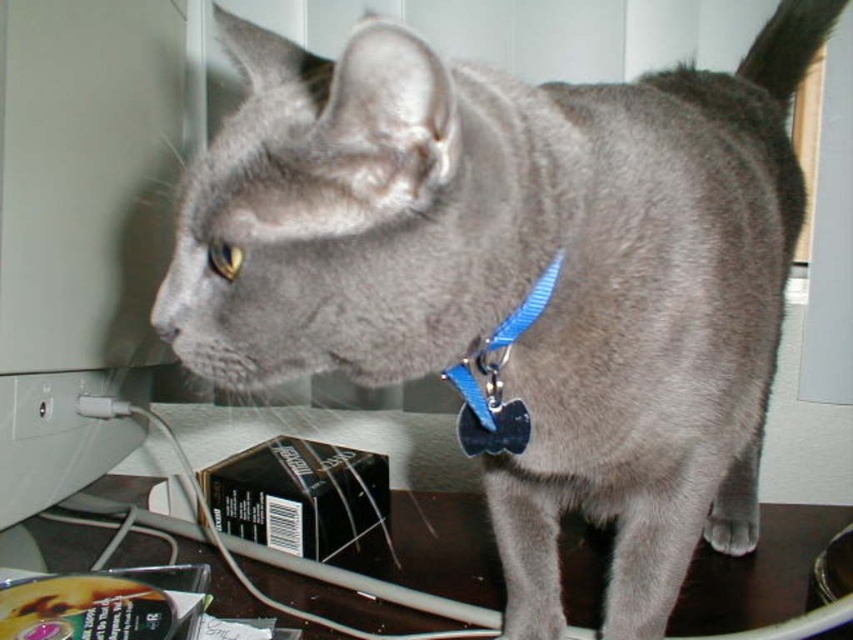
From the picture: Does matte gray computer monitor at left have a lesser width compared to brown wood computer desk at lower center?

Yes.

Who is more forward, (33, 371) or (201, 502)?

Point (33, 371) is in front.

Who is more distant from viewer, (106, 177) or (352, 573)?

The point (106, 177) is behind.

Find the location of a particular element. matte gray computer monitor at left is located at coordinates (80, 227).

Which is below, brown wood computer desk at lower center or blue plastic tag at center?

brown wood computer desk at lower center

Measure the distance between brown wood computer desk at lower center and camera.

brown wood computer desk at lower center is 24.55 inches from camera.

Is point (213, 545) closer to camera compared to point (453, 385)?

No, (213, 545) is behind (453, 385).

The image size is (853, 640). Identify the location of brown wood computer desk at lower center. (291, 556).

Looking at this image, can you confirm if matte gray computer monitor at left is wider than blue plastic tag at center?

Yes, matte gray computer monitor at left is wider than blue plastic tag at center.

Does matte gray computer monitor at left appear on the right side of blue plastic tag at center?

No, matte gray computer monitor at left is not to the right of blue plastic tag at center.

Does point (54, 189) lie in front of point (462, 362)?

No, it is behind (462, 362).

Where is `matte gray computer monitor at left`? Image resolution: width=853 pixels, height=640 pixels. matte gray computer monitor at left is located at coordinates [80, 227].